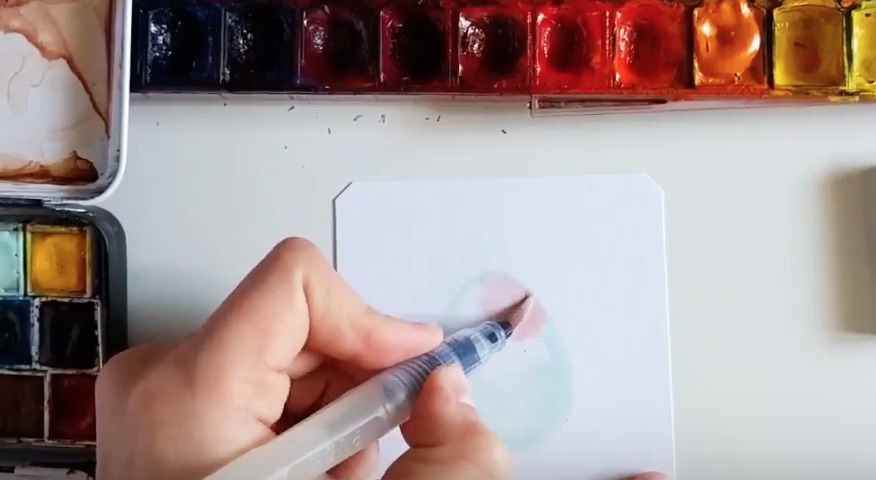
This screenshot has height=480, width=876. Find the location of `dark red paint`. dark red paint is located at coordinates (475, 90).